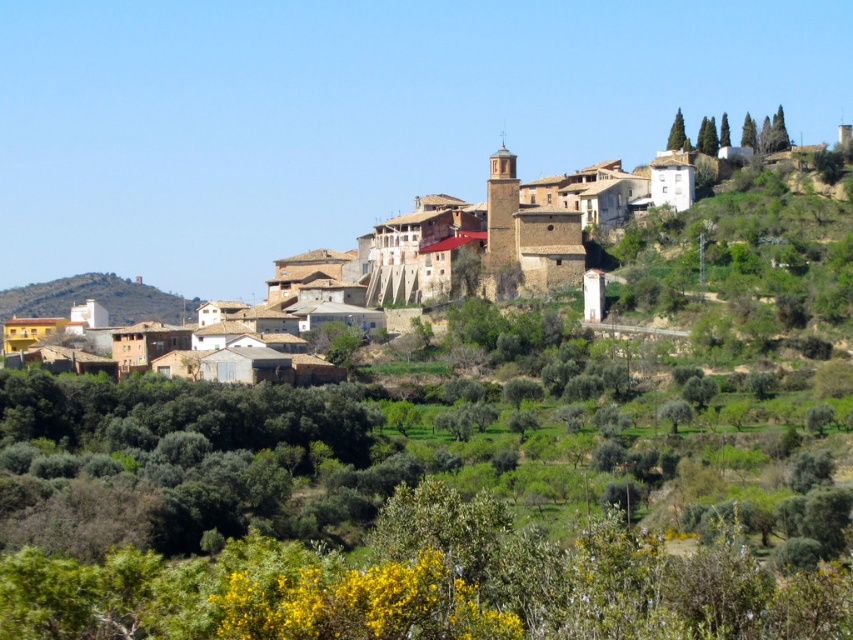
Question: Is brown stone buildings at center below brown textured hillside at left?

Choices:
 (A) no
 (B) yes

Answer: (A)

Question: Which point is closer to the camera taking this photo?

Choices:
 (A) (804, 221)
 (B) (79, 300)

Answer: (A)

Question: Which point is farther to the camera?

Choices:
 (A) (692, 156)
 (B) (6, 296)

Answer: (B)

Question: Is brown stone buildings at center to the left of brown textured hillside at left from the viewer's perspective?

Choices:
 (A) no
 (B) yes

Answer: (A)

Question: Does brown stone buildings at center have a lesser width compared to brown textured hillside at left?

Choices:
 (A) yes
 (B) no

Answer: (B)